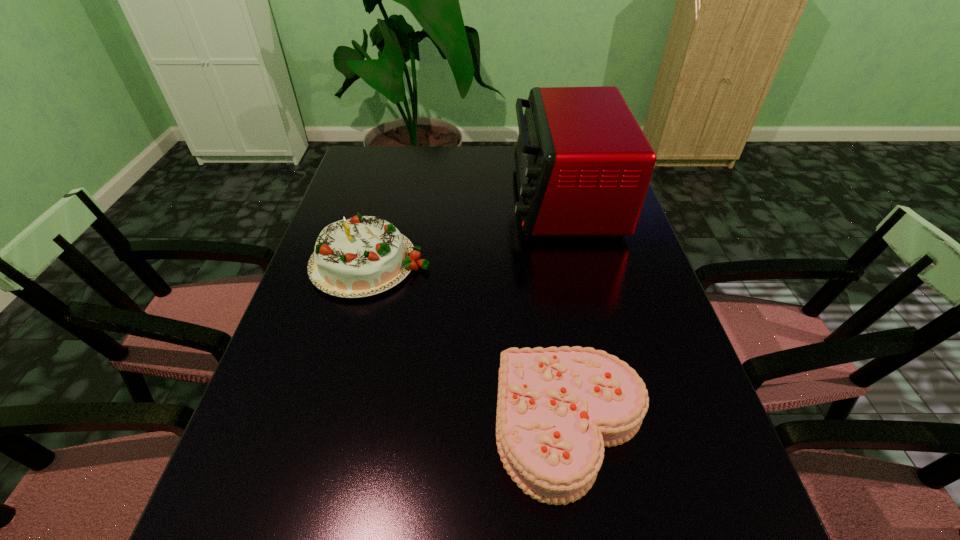
Locate an element on the screen. The width and height of the screenshot is (960, 540). object that is positioned at the far edge is located at coordinates point(583,165).

This screenshot has height=540, width=960. I want to click on object at the left edge, so click(361, 256).

Identify the location of toaster oven situated at the right edge. The image size is (960, 540). (583, 165).

Locate an element on the screen. The height and width of the screenshot is (540, 960). cake at the right edge is located at coordinates (557, 408).

Locate an element on the screen. object located in the far right corner section of the desktop is located at coordinates (583, 165).

At what (x,y) coordinates should I click in order to perform the action: click on free spot at the far edge of the desktop. Please return your answer as a coordinate pair (x, y). The width and height of the screenshot is (960, 540). Looking at the image, I should click on (424, 159).

You are a GUI agent. You are given a task and a screenshot of the screen. Output one action in this format:
    pyautogui.click(x=<x>, y=<y>)
    Task: Click on the free region at the near edge of the desktop
    The image size is (960, 540).
    Given the screenshot: What is the action you would take?
    pyautogui.click(x=394, y=538)

Image resolution: width=960 pixels, height=540 pixels. Find the location of `vacant point at the left edge`. vacant point at the left edge is located at coordinates (356, 184).

At what (x,y) coordinates should I click in order to perform the action: click on vacant space at the right edge of the desktop. Please return your answer as a coordinate pair (x, y). Image resolution: width=960 pixels, height=540 pixels. Looking at the image, I should click on (679, 348).

Where is `free space at the far left corner of the desktop`? free space at the far left corner of the desktop is located at coordinates (350, 173).